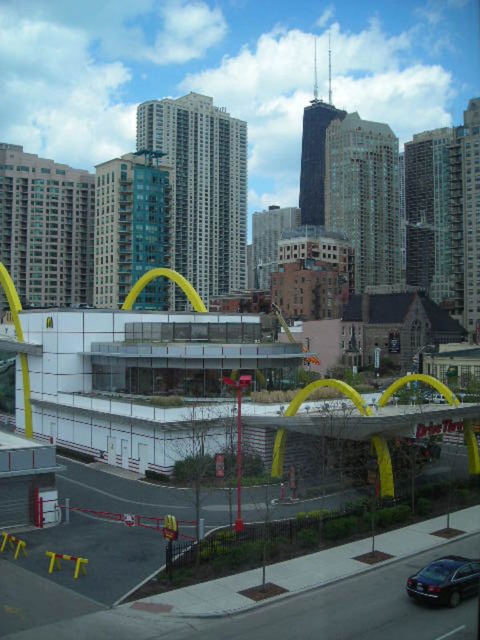
Question: Does shiny black sedan at lower right appear under yellow rubber at center?

Choices:
 (A) yes
 (B) no

Answer: (A)

Question: Is shiny black sedan at lower right bigger than yellow rubber at center?

Choices:
 (A) no
 (B) yes

Answer: (A)

Question: Which object appears closest to the camera in this image?

Choices:
 (A) yellow rubber at center
 (B) shiny black sedan at lower right

Answer: (B)

Question: Does shiny black sedan at lower right appear under yellow rubber at center?

Choices:
 (A) yes
 (B) no

Answer: (A)